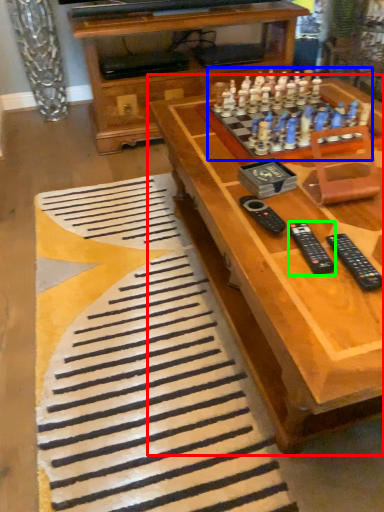
Question: Which object is positioned farthest from table (highlighted by a red box)? Select from game (highlighted by a blue box) and remote (highlighted by a green box).

Choices:
 (A) game
 (B) remote

Answer: (B)